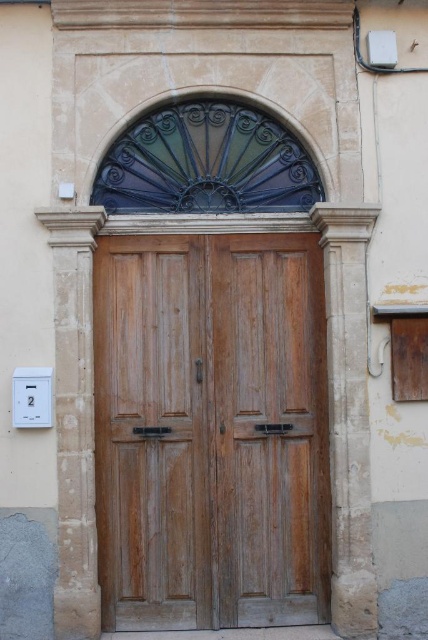
Between wooden door at center and white plastic electric outlet at lower left, which one is positioned lower?

Positioned lower is wooden door at center.

Is wooden door at center positioned in front of white plastic electric outlet at lower left?

No, wooden door at center is further to the viewer.

Measure the distance between wooden door at center and camera.

wooden door at center is 6.98 meters away from camera.

You are a GUI agent. You are given a task and a screenshot of the screen. Output one action in this format:
    pyautogui.click(x=<x>, y=<y>)
    Task: Click on the wooden door at center
    The height and width of the screenshot is (640, 428).
    Given the screenshot: What is the action you would take?
    pyautogui.click(x=211, y=432)